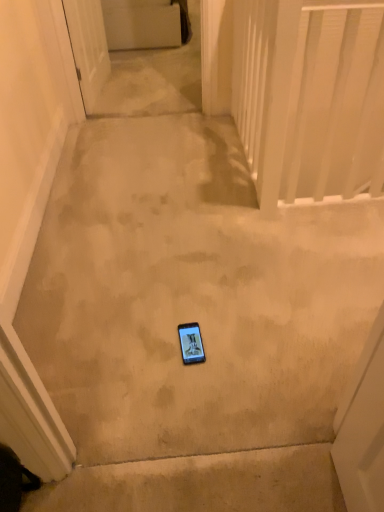
Question: Is white glossy door at upper left oriented towards matte black phone at center?

Choices:
 (A) yes
 (B) no

Answer: (B)

Question: Is white glossy door at upper left placed right next to matte black phone at center?

Choices:
 (A) yes
 (B) no

Answer: (B)

Question: Would you say matte black phone at center is part of white glossy door at upper left's contents?

Choices:
 (A) yes
 (B) no

Answer: (B)

Question: Can you confirm if white glossy door at upper left is wider than matte black phone at center?

Choices:
 (A) yes
 (B) no

Answer: (A)

Question: Can you confirm if white glossy door at upper left is smaller than matte black phone at center?

Choices:
 (A) yes
 (B) no

Answer: (B)

Question: In terms of size, does white glossy door at upper left appear bigger or smaller than matte black phone at center?

Choices:
 (A) big
 (B) small

Answer: (A)

Question: In terms of height, does white glossy door at upper left look taller or shorter compared to matte black phone at center?

Choices:
 (A) short
 (B) tall

Answer: (B)

Question: Visually, is white glossy door at upper left positioned to the left or to the right of matte black phone at center?

Choices:
 (A) left
 (B) right

Answer: (A)

Question: Looking at their shapes, would you say white glossy door at upper left is wider or thinner than matte black phone at center?

Choices:
 (A) wide
 (B) thin

Answer: (A)

Question: Choose the correct answer: Is matte black phone at center inside white glossy door at upper left or outside it?

Choices:
 (A) inside
 (B) outside

Answer: (B)

Question: Is matte black phone at center in front of or behind white glossy door at upper left in the image?

Choices:
 (A) front
 (B) behind

Answer: (A)

Question: Is point (190, 337) positioned closer to the camera than point (79, 25)?

Choices:
 (A) closer
 (B) farther

Answer: (A)

Question: Is matte black phone at center bigger or smaller than white glossy door at upper left?

Choices:
 (A) big
 (B) small

Answer: (B)

Question: Looking at the image, does white plastic balustrade at upper right seem bigger or smaller compared to matte black phone at center?

Choices:
 (A) small
 (B) big

Answer: (B)

Question: Looking at their shapes, would you say white plastic balustrade at upper right is wider or thinner than matte black phone at center?

Choices:
 (A) wide
 (B) thin

Answer: (A)